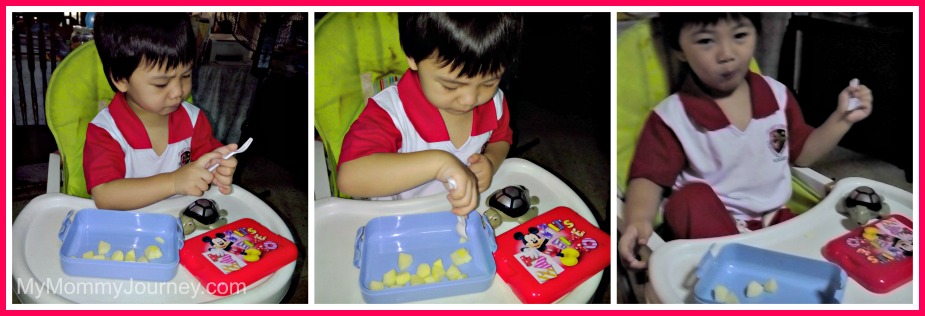
At what (x,y) coordinates should I click in order to perform the action: click on high chair. Please return your answer as a coordinate pair (x, y). This screenshot has width=925, height=316. Looking at the image, I should click on (341, 89).